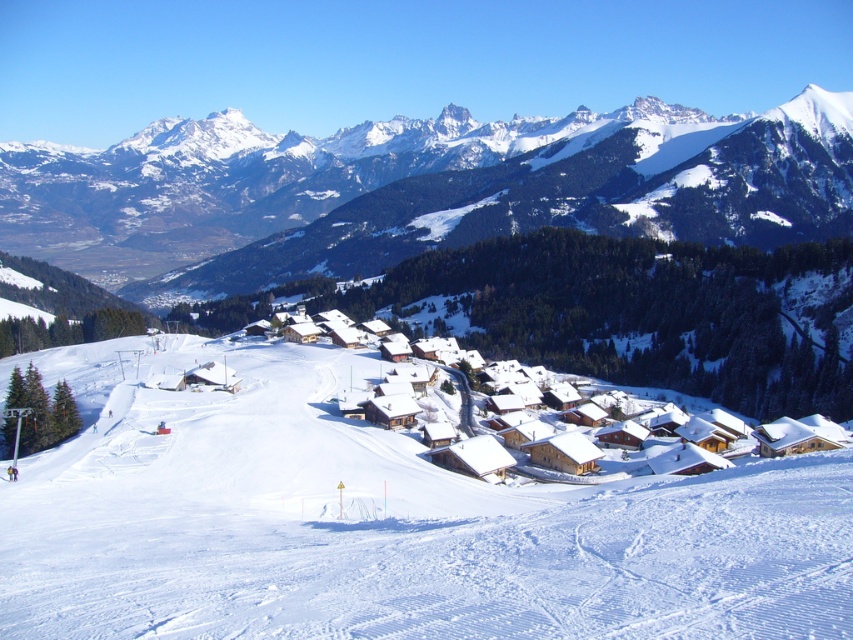
You are a tourist planning to take a photo of the wooden chalet at center and the white snow ski slope at center from the valley floor. Based on their positions, which object should you frame first in your camera viewfinder to ensure both are in the shot?

The white snow ski slope at center is positioned on the left side of wooden chalet at center, so you should frame the wooden chalet at center first since it is to the right, allowing both objects to be captured in the viewfinder.

You are a drone operator trying to capture a photo of the snowy rocky mountain range at upper center. The drone has a maximum flight range of 500 meters. Given that the mountain is located at coordinates point 0.298, 0.490 in the image, can you estimate if the drone can reach it within its range?

The snowy rocky mountain range at upper center is located at point (x=416, y=189) in the image. Since the drone has a maximum flight range of 500 meters, it can easily reach the mountain within its range as the coordinates indicate it is within a reasonable distance from the operator.